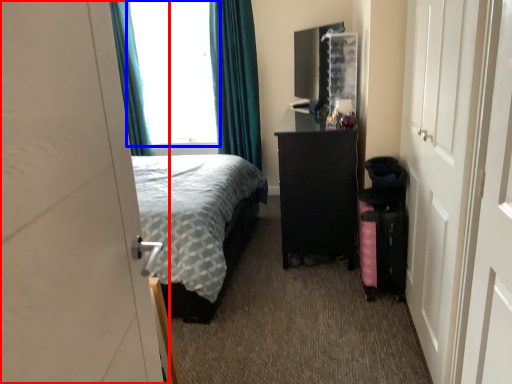
Question: Which point is closer to the camera, door (highlighted by a red box) or window (highlighted by a blue box)?

Choices:
 (A) door
 (B) window

Answer: (A)